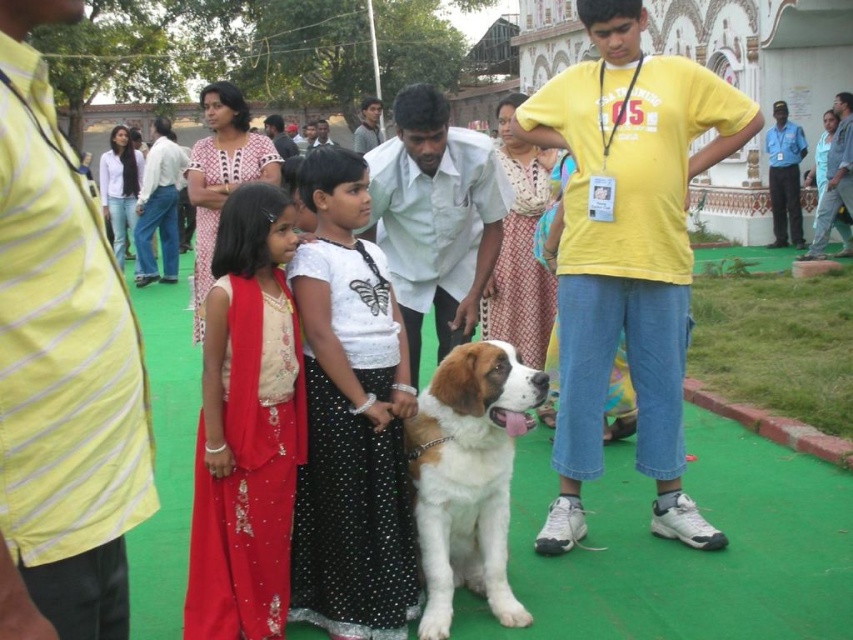
Question: Does white dotted skirt at center have a greater width compared to shiny red dress at center?

Choices:
 (A) no
 (B) yes

Answer: (A)

Question: Estimate the real-world distances between objects in this image. Which object is closer to the white dotted skirt at center?

Choices:
 (A) shiny red dress at center
 (B) white fur with brown patches at center

Answer: (A)

Question: Which of the following is the closest to the observer?

Choices:
 (A) (471, 508)
 (B) (270, 636)
 (C) (361, 410)

Answer: (B)

Question: Which is nearer to the shiny red dress at center?

Choices:
 (A) white dotted skirt at center
 (B) white fur with brown patches at center

Answer: (A)

Question: Does shiny red dress at center have a larger size compared to white fur with brown patches at center?

Choices:
 (A) no
 (B) yes

Answer: (B)

Question: Does white dotted skirt at center have a larger size compared to shiny red dress at center?

Choices:
 (A) no
 (B) yes

Answer: (B)